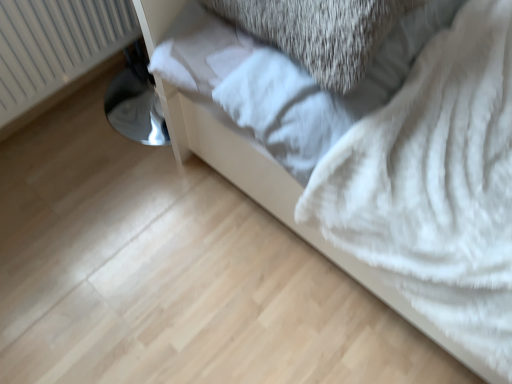
Find the location of a particular element. The image size is (512, 384). free spot to the right of white plastic radiator at left is located at coordinates (111, 129).